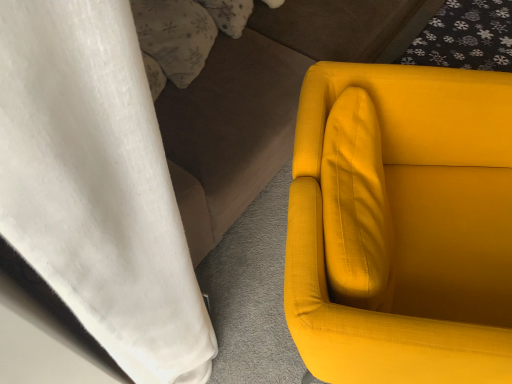
Image resolution: width=512 pixels, height=384 pixels. In order to click on fluffy white pillow at upper left in this screenshot , I will do `click(175, 36)`.

Locate an element on the screen. fluffy white pillow at upper left is located at coordinates (175, 36).

In terms of size, does fluffy white pillow at upper left appear bigger or smaller than matte yellow fabric chair at right?

Considering their sizes, fluffy white pillow at upper left takes up less space than matte yellow fabric chair at right.

Where is `pillow that is above the matte yellow fabric chair at right (from the image's perspective)`? pillow that is above the matte yellow fabric chair at right (from the image's perspective) is located at coordinates (175, 36).

From a real-world perspective, is fluffy white pillow at upper left over matte yellow fabric chair at right?

Indeed, from a real-world perspective, fluffy white pillow at upper left stands above matte yellow fabric chair at right.

Are fluffy white pillow at upper left and matte yellow fabric chair at right far apart?

fluffy white pillow at upper left is actually quite close to matte yellow fabric chair at right.

Is matte yellow fabric chair at right spatially inside matte yellow fabric couch at right, or outside of it?

matte yellow fabric chair at right is not inside matte yellow fabric couch at right, it's outside.

Is point (399, 120) closer to viewer compared to point (210, 244)?

Yes, point (399, 120) is closer to viewer.

Is matte yellow fabric chair at right facing towards matte yellow fabric couch at right?

No, matte yellow fabric chair at right does not turn towards matte yellow fabric couch at right.

From the image's perspective, is fluffy white pillow at upper left above matte yellow fabric couch at right?

Actually, fluffy white pillow at upper left appears below matte yellow fabric couch at right in the image.

Is point (165, 71) more distant than point (290, 86)?

No.

Where is `pillow below the matte yellow fabric couch at right (from the image's perspective)`? This screenshot has height=384, width=512. pillow below the matte yellow fabric couch at right (from the image's perspective) is located at coordinates (175, 36).

From the image's perspective, is matte yellow fabric couch at right located above or below matte yellow fabric chair at right?

matte yellow fabric couch at right is situated higher than matte yellow fabric chair at right in the image.

Is matte yellow fabric couch at right oriented away from matte yellow fabric chair at right?

No, matte yellow fabric couch at right is not facing the opposite direction of matte yellow fabric chair at right.

Between matte yellow fabric couch at right and matte yellow fabric chair at right, which one has more height?

Standing taller between the two is matte yellow fabric couch at right.

Considering the sizes of matte yellow fabric couch at right and matte yellow fabric chair at right in the image, is matte yellow fabric couch at right wider or thinner than matte yellow fabric chair at right?

In the image, matte yellow fabric couch at right appears to be wider than matte yellow fabric chair at right.

Considering the positions of objects matte yellow fabric couch at right and fluffy white pillow at upper left in the image provided, who is in front, matte yellow fabric couch at right or fluffy white pillow at upper left?

matte yellow fabric couch at right.

From a real-world perspective, is matte yellow fabric couch at right located higher than fluffy white pillow at upper left?

Actually, matte yellow fabric couch at right is physically below fluffy white pillow at upper left in the real world.

Looking at this image, can you confirm if matte yellow fabric couch at right is bigger than fluffy white pillow at upper left?

Correct, matte yellow fabric couch at right is larger in size than fluffy white pillow at upper left.

Identify the location of pillow on the left side of matte yellow fabric couch at right. (175, 36).

Where is `pillow on the left of matte yellow fabric chair at right`? The width and height of the screenshot is (512, 384). pillow on the left of matte yellow fabric chair at right is located at coordinates (175, 36).

In the scene shown: Is matte yellow fabric chair at right surrounding fluffy white pillow at upper left?

No, matte yellow fabric chair at right does not contain fluffy white pillow at upper left.

Looking at the image, does matte yellow fabric chair at right seem bigger or smaller compared to fluffy white pillow at upper left?

Considering their sizes, matte yellow fabric chair at right takes up more space than fluffy white pillow at upper left.

Can you tell me how much matte yellow fabric chair at right and fluffy white pillow at upper left differ in facing direction?

There is a 8.5-degree angle between the facing directions of matte yellow fabric chair at right and fluffy white pillow at upper left.

Find the location of a particular element. pillow behind the matte yellow fabric chair at right is located at coordinates (175, 36).

Find the location of a particular element. The width and height of the screenshot is (512, 384). couch on the left side of matte yellow fabric chair at right is located at coordinates (263, 100).

Based on the photo, which object lies further to the anchor point matte yellow fabric couch at right, fluffy white pillow at upper left or matte yellow fabric chair at right?

matte yellow fabric chair at right is positioned further to the anchor matte yellow fabric couch at right.

Estimate the real-world distances between objects in this image. Which object is closer to matte yellow fabric couch at right, matte yellow fabric chair at right or fluffy white pillow at upper left?

Among the two, fluffy white pillow at upper left is located nearer to matte yellow fabric couch at right.

Looking at this image, which object lies further to the anchor point fluffy white pillow at upper left, matte yellow fabric couch at right or matte yellow fabric chair at right?

matte yellow fabric chair at right.

Estimate the real-world distances between objects in this image. Which object is closer to fluffy white pillow at upper left, matte yellow fabric chair at right or matte yellow fabric couch at right?

matte yellow fabric couch at right.

Estimate the real-world distances between objects in this image. Which object is further from matte yellow fabric chair at right, fluffy white pillow at upper left or matte yellow fabric couch at right?

fluffy white pillow at upper left is positioned further to the anchor matte yellow fabric chair at right.

Looking at the image, which one is located further to matte yellow fabric chair at right, matte yellow fabric couch at right or fluffy white pillow at upper left?

Based on the image, fluffy white pillow at upper left appears to be further to matte yellow fabric chair at right.

This screenshot has height=384, width=512. I want to click on pillow between matte yellow fabric couch at right and matte yellow fabric chair at right from top to bottom, so pos(175,36).